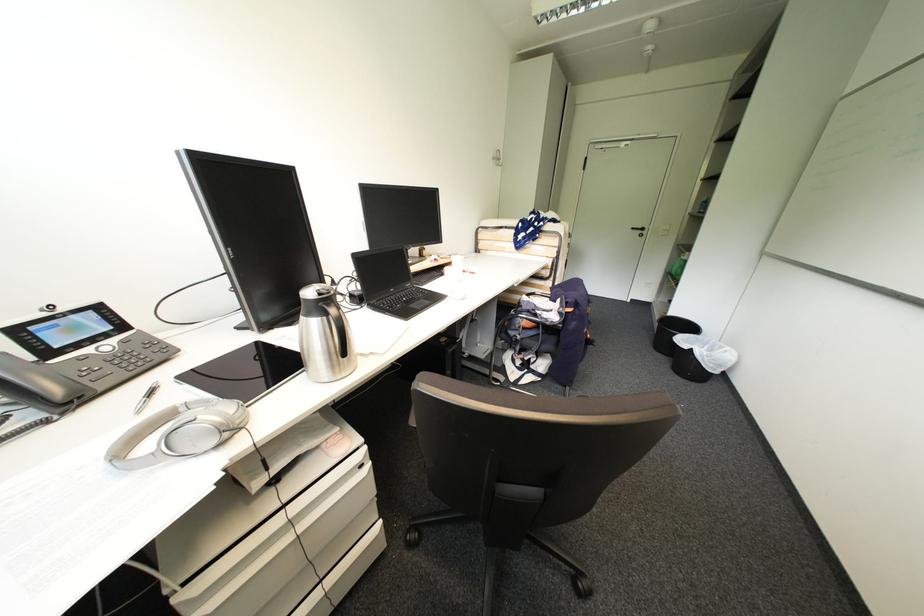
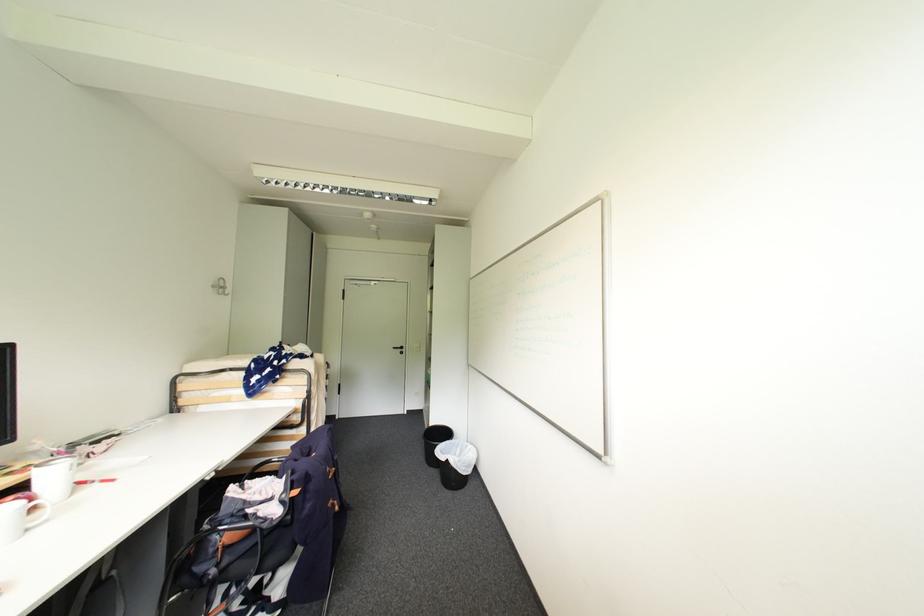
Find the pixel in the second image that matches point (699, 336) in the first image.

(456, 442)